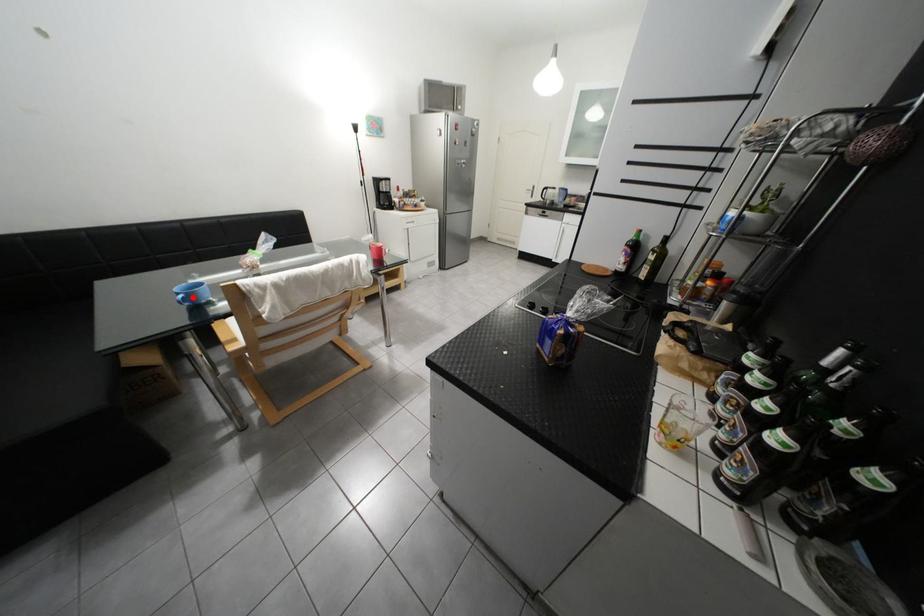
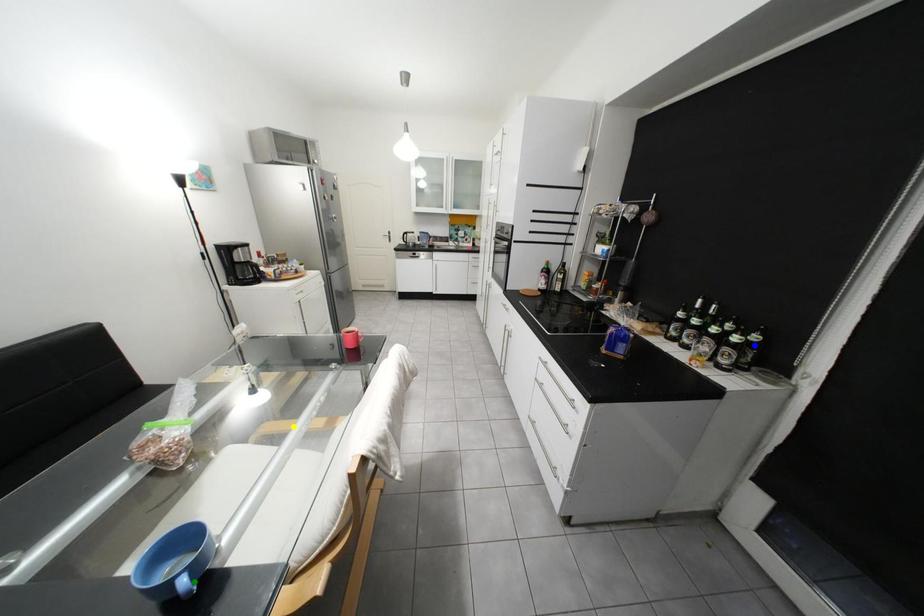
Question: I am providing you with two images of the same scene from different viewpoints. A red point is marked on the first image. You are given multiple points on the second image. Which point in image 2 represents the same 3d spot as the red point in image 1?

Choices:
 (A) yellow point
 (B) blue point
 (C) green point

Answer: (C)